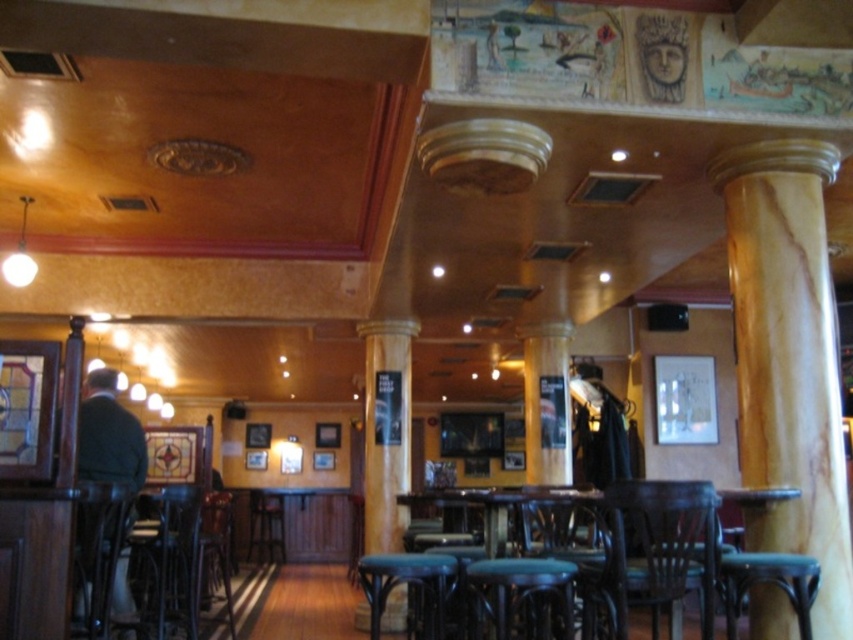
Is wooden chair at center below green fabric stool at center?

No, wooden chair at center is not below green fabric stool at center.

Which is above, wooden chair at center or green fabric stool at center?

wooden chair at center is higher up.

Who is more forward, (630, 525) or (515, 572)?

Positioned in front is point (515, 572).

Identify the location of wooden chair at center. (653, 552).

Between wooden textured chair at center and wooden bar stool at center, which one appears on the left side from the viewer's perspective?

From the viewer's perspective, wooden bar stool at center appears more on the left side.

Does point (573, 531) come closer to viewer compared to point (270, 515)?

Yes, point (573, 531) is closer to viewer.

Between point (531, 550) and point (265, 499), which one is positioned behind?

The point (265, 499) is more distant.

Image resolution: width=853 pixels, height=640 pixels. Identify the location of wooden textured chair at center. (572, 548).

Between point (624, 580) and point (91, 465), which one is positioned behind?

Point (91, 465)

Which is more to the left, wooden chair at center or dark green sweater at left?

Positioned to the left is dark green sweater at left.

Who is more distant from viewer, (637, 579) or (129, 444)?

Positioned behind is point (129, 444).

The height and width of the screenshot is (640, 853). I want to click on wooden chair at center, so [x=653, y=552].